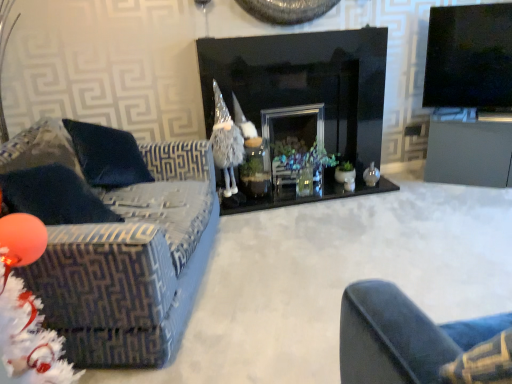
At what (x,y) coordinates should I click in order to perform the action: click on blank space situated above black glossy tv at upper right (from a real-world perspective). Please return your answer as a coordinate pair (x, y). The width and height of the screenshot is (512, 384). Looking at the image, I should click on (468, 2).